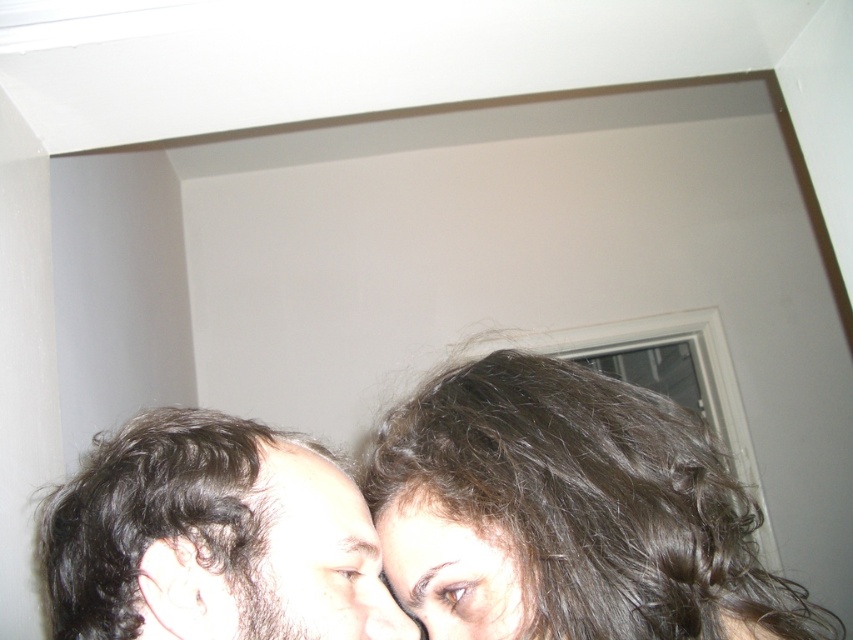
You are a photographer adjusting the lighting in the scene. You notice the dark curly hair at lower left and the matte black nose at center. Which object is located more to the left side?

The dark curly hair at lower left is positioned on the left side of the matte black nose at center, so it is more to the left.

You are a photographer adjusting the lighting for a portrait. You notice the dark brown hair at center and the pale skin at center in your frame. Which object should you adjust the light to highlight more effectively, considering their positions?

The dark brown hair at center is taller than pale skin at center, so adjusting the light to highlight the dark brown hair at center would be more effective due to its elevated position.